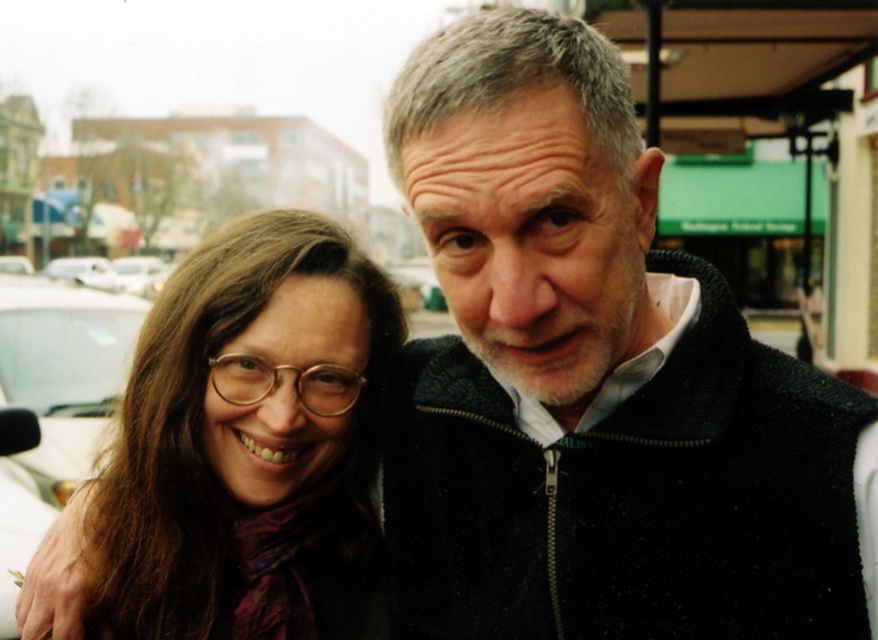
Looking at this image, you are a photographer setting up a shot of the matte brown hair at center and the white matte car at left. You need to adjust the camera focus so that both subjects are in focus. Considering their sizes, which subject should you focus on to ensure both are sharp?

Since the matte brown hair at center is much taller than the white matte car at left, focusing on the matte brown hair at center would ensure both are in focus because it is larger in the frame and closer to the camera.

You are designing a poster and need to know which object is wider between the matte brown hair at center and the white matte car at left. Can you tell me which one is wider?

The matte brown hair at center is wider than the white matte car at left according to the description.